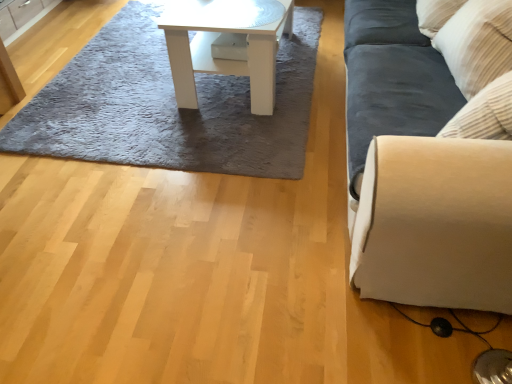
Locate an element on the screen. Image resolution: width=512 pixels, height=384 pixels. suede-like beige couch at right is located at coordinates (430, 152).

At what (x,y) coordinates should I click in order to perform the action: click on matte wood cabinet at upper left. Please return your answer as a coordinate pair (x, y). Image resolution: width=512 pixels, height=384 pixels. Looking at the image, I should click on (24, 18).

Identify the location of white glossy table at center. Image resolution: width=512 pixels, height=384 pixels. (216, 38).

Choose the correct answer: Is suede-like beige couch at right inside matte wood cabinet at upper left or outside it?

suede-like beige couch at right is not enclosed by matte wood cabinet at upper left.

Is suede-like beige couch at right placed right next to matte wood cabinet at upper left?

No, suede-like beige couch at right is not in contact with matte wood cabinet at upper left.

Is suede-like beige couch at right turned away from matte wood cabinet at upper left?

No, suede-like beige couch at right's orientation is not away from matte wood cabinet at upper left.

From the image's perspective, which is below, suede-like beige couch at right or matte wood cabinet at upper left?

suede-like beige couch at right, from the image's perspective.

From the image's perspective, between white glossy table at center and matte wood cabinet at upper left, who is located below?

white glossy table at center is shown below in the image.

Considering the sizes of white glossy table at center and matte wood cabinet at upper left in the image, is white glossy table at center taller or shorter than matte wood cabinet at upper left?

Considering their sizes, white glossy table at center has more height than matte wood cabinet at upper left.

Considering the positions of objects white glossy table at center and matte wood cabinet at upper left in the image provided, who is more to the left, white glossy table at center or matte wood cabinet at upper left?

matte wood cabinet at upper left.

Does gray shaggy rug at upper center have a lesser height compared to matte wood cabinet at upper left?

Indeed, gray shaggy rug at upper center has a lesser height compared to matte wood cabinet at upper left.

Consider the image. Which is behind, gray shaggy rug at upper center or matte wood cabinet at upper left?

matte wood cabinet at upper left is further from the camera.

From a real-world perspective, who is located lower, gray shaggy rug at upper center or matte wood cabinet at upper left?

gray shaggy rug at upper center is physically lower.

Between gray shaggy rug at upper center and matte wood cabinet at upper left, which one has smaller width?

matte wood cabinet at upper left is thinner.

I want to click on studio couch on the right side of white glossy table at center, so click(430, 152).

Would you say suede-like beige couch at right is inside or outside white glossy table at center?

The correct answer is: outside.

Is suede-like beige couch at right positioned with its back to white glossy table at center?

That's not correct — suede-like beige couch at right is not looking away from white glossy table at center.

Do you think suede-like beige couch at right is within gray shaggy rug at upper center, or outside of it?

suede-like beige couch at right exists outside the volume of gray shaggy rug at upper center.

Is suede-like beige couch at right facing towards gray shaggy rug at upper center?

Yes, suede-like beige couch at right is facing gray shaggy rug at upper center.

Considering the sizes of objects suede-like beige couch at right and gray shaggy rug at upper center in the image provided, who is smaller, suede-like beige couch at right or gray shaggy rug at upper center?

gray shaggy rug at upper center is smaller.

Looking at this image, does suede-like beige couch at right appear on the right side of gray shaggy rug at upper center?

Yes.

In the image, there is a white glossy table at center. At what (x,y) coordinates should I click in order to perform the action: click on cabinetry above it (from the image's perspective). Please return your answer as a coordinate pair (x, y). Looking at the image, I should click on (24, 18).

Which is correct: matte wood cabinet at upper left is inside white glossy table at center, or outside of it?

matte wood cabinet at upper left is not inside white glossy table at center, it's outside.

From a real-world perspective, is matte wood cabinet at upper left below white glossy table at center?

Correct, in the physical world, matte wood cabinet at upper left is lower than white glossy table at center.

Which of these two, gray shaggy rug at upper center or white glossy table at center, stands taller?

Standing taller between the two is white glossy table at center.

Is gray shaggy rug at upper center thinner than white glossy table at center?

No.

From a real-world perspective, who is located lower, gray shaggy rug at upper center or white glossy table at center?

gray shaggy rug at upper center.

Considering the sizes of objects gray shaggy rug at upper center and white glossy table at center in the image provided, who is smaller, gray shaggy rug at upper center or white glossy table at center?

With smaller size is gray shaggy rug at upper center.

Identify the location of cabinetry located on the left of suede-like beige couch at right. The image size is (512, 384). (24, 18).

Where is `table above the matte wood cabinet at upper left (from a real-world perspective)`? Image resolution: width=512 pixels, height=384 pixels. table above the matte wood cabinet at upper left (from a real-world perspective) is located at coordinates (216, 38).

Considering their positions, is white glossy table at center positioned closer to gray shaggy rug at upper center than suede-like beige couch at right?

white glossy table at center lies closer to gray shaggy rug at upper center than the other object.

Looking at the image, which one is located closer to matte wood cabinet at upper left, white glossy table at center or suede-like beige couch at right?

white glossy table at center.

Based on their spatial positions, is matte wood cabinet at upper left or suede-like beige couch at right further from gray shaggy rug at upper center?

matte wood cabinet at upper left is further to gray shaggy rug at upper center.

Which object lies nearer to the anchor point white glossy table at center, suede-like beige couch at right or matte wood cabinet at upper left?

suede-like beige couch at right lies closer to white glossy table at center than the other object.

When comparing their distances from suede-like beige couch at right, does gray shaggy rug at upper center or white glossy table at center seem further?

Based on the image, gray shaggy rug at upper center appears to be further to suede-like beige couch at right.

Based on their spatial positions, is suede-like beige couch at right or gray shaggy rug at upper center closer to matte wood cabinet at upper left?

gray shaggy rug at upper center is positioned closer to the anchor matte wood cabinet at upper left.

Looking at this image, when comparing their distances from matte wood cabinet at upper left, does gray shaggy rug at upper center or suede-like beige couch at right seem further?

Based on the image, suede-like beige couch at right appears to be further to matte wood cabinet at upper left.

When comparing their distances from suede-like beige couch at right, does gray shaggy rug at upper center or matte wood cabinet at upper left seem closer?

The object closer to suede-like beige couch at right is gray shaggy rug at upper center.

You are a GUI agent. You are given a task and a screenshot of the screen. Output one action in this format:
    pyautogui.click(x=<x>, y=<y>)
    Task: Click on the table between matte wood cabinet at upper left and suede-like beige couch at right
    The width and height of the screenshot is (512, 384).
    Given the screenshot: What is the action you would take?
    pyautogui.click(x=216, y=38)

Where is `mat between matte wood cabinet at upper left and suede-like beige couch at right in the horizontal direction`? The height and width of the screenshot is (384, 512). mat between matte wood cabinet at upper left and suede-like beige couch at right in the horizontal direction is located at coordinates (168, 106).

Locate an element on the screen. table between gray shaggy rug at upper center and suede-like beige couch at right in the horizontal direction is located at coordinates (216, 38).

You are a GUI agent. You are given a task and a screenshot of the screen. Output one action in this format:
    pyautogui.click(x=<x>, y=<y>)
    Task: Click on the mat situated between matte wood cabinet at upper left and white glossy table at center from left to right
    This screenshot has height=384, width=512.
    Given the screenshot: What is the action you would take?
    pyautogui.click(x=168, y=106)